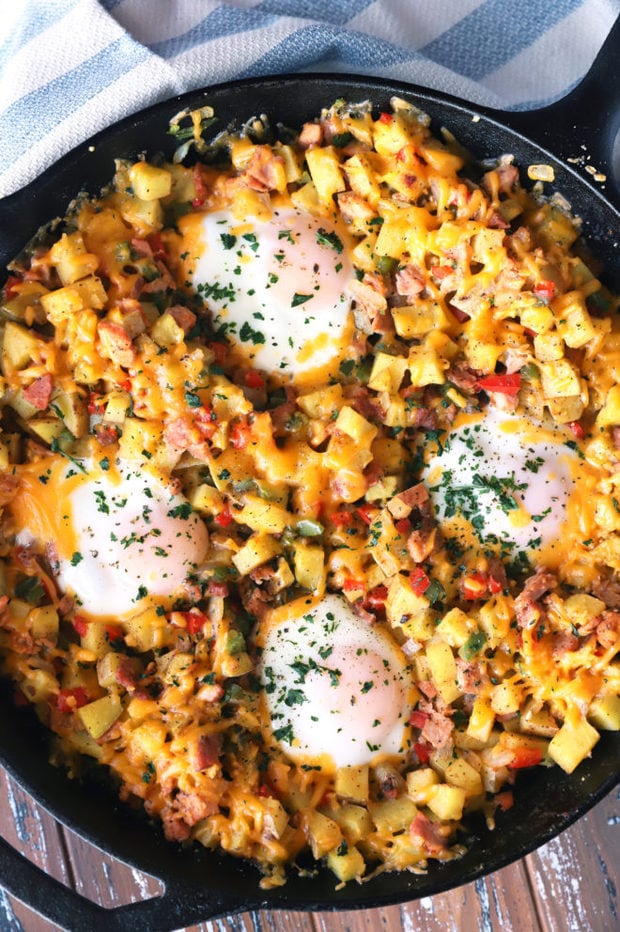
Where is `table slats`? This screenshot has height=932, width=620. table slats is located at coordinates (583, 878), (463, 905), (353, 915), (242, 917), (108, 869), (38, 841).